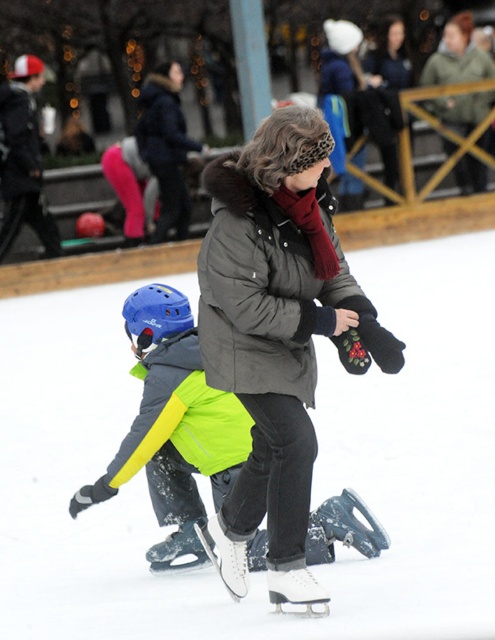
You are an observer at the ice rink. You notice two jackets in the scene. Which one is bigger between the matte black jacket at upper left and the dark green jacket at upper center?

The matte black jacket at upper left is larger in size than the dark green jacket at upper center.

You are standing at the center of the ice rink and want to locate the matte black jacket at upper left. Based on the coordinates provided, in which direction should you look to find it?

The matte black jacket at upper left is located at coordinates point (22, 157). Since the y coordinate is 0.046, which is near the bottom of the image, you should look downward from the center to find it.

Consider the image. Based on the scene described, which object is positioned to the left when comparing the matte black jacket at upper left and the dark green jacket at upper center?

The matte black jacket at upper left is positioned to the left of the dark green jacket at upper center.